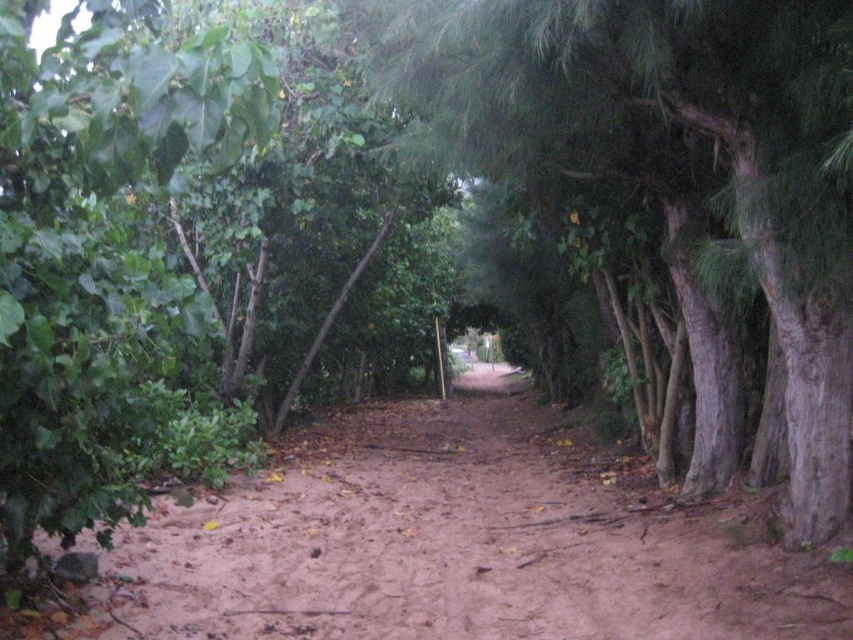
Is brown dirt track at center further to camera compared to dirt path at center?

No, brown dirt track at center is in front of dirt path at center.

Describe the element at coordinates (456, 545) in the screenshot. The width and height of the screenshot is (853, 640). I see `brown dirt track at center` at that location.

Which is in front, point (792, 564) or point (505, 369)?

Positioned in front is point (792, 564).

Image resolution: width=853 pixels, height=640 pixels. In order to click on brown dirt track at center in this screenshot , I will do `click(456, 545)`.

Is green rough bark tree at center taller than dirt path at center?

Correct, green rough bark tree at center is much taller as dirt path at center.

Does green rough bark tree at center have a lesser height compared to dirt path at center?

Incorrect, green rough bark tree at center's height does not fall short of dirt path at center's.

Describe the element at coordinates (675, 150) in the screenshot. I see `green rough bark tree at center` at that location.

This screenshot has height=640, width=853. In order to click on green rough bark tree at center in this screenshot , I will do `click(675, 150)`.

In the scene shown: Is brown dirt track at center above green rough bark tree at center?

No.

Is point (397, 586) farther from viewer compared to point (804, 193)?

That is True.

Who is more distant from viewer, (525,609) or (720,61)?

Positioned behind is point (525,609).

In order to click on brown dirt track at center in this screenshot , I will do `click(456, 545)`.